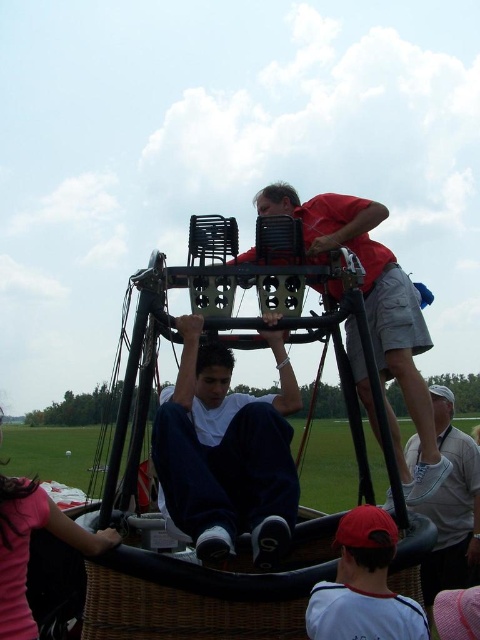
Can you confirm if red shirt at upper center is positioned below matte red cap at lower center?

Incorrect, red shirt at upper center is not positioned below matte red cap at lower center.

Does red shirt at upper center appear over matte red cap at lower center?

Yes, red shirt at upper center is above matte red cap at lower center.

Locate an element on the screen. The height and width of the screenshot is (640, 480). red shirt at upper center is located at coordinates (374, 312).

Between woven wicker basket at lower center and red shirt at upper center, which one has more height?

With more height is red shirt at upper center.

Image resolution: width=480 pixels, height=640 pixels. What do you see at coordinates (202, 595) in the screenshot?
I see `woven wicker basket at lower center` at bounding box center [202, 595].

Image resolution: width=480 pixels, height=640 pixels. In order to click on woven wicker basket at lower center in this screenshot , I will do `click(202, 595)`.

Is matte red cap at lower center thinner than matte pink shirt at lower left?

Indeed, matte red cap at lower center has a lesser width compared to matte pink shirt at lower left.

Between point (371, 556) and point (0, 481), which one is positioned behind?

The point (0, 481) is more distant.

What are the coordinates of `matte red cap at lower center` in the screenshot? It's located at (363, 586).